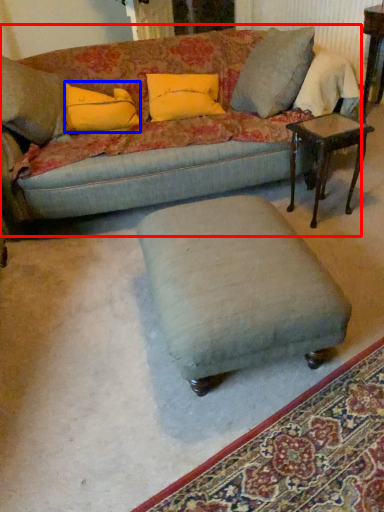
Question: Which object appears farthest to the camera in this image, studio couch (highlighted by a red box) or pillow (highlighted by a blue box)?

Choices:
 (A) studio couch
 (B) pillow

Answer: (B)